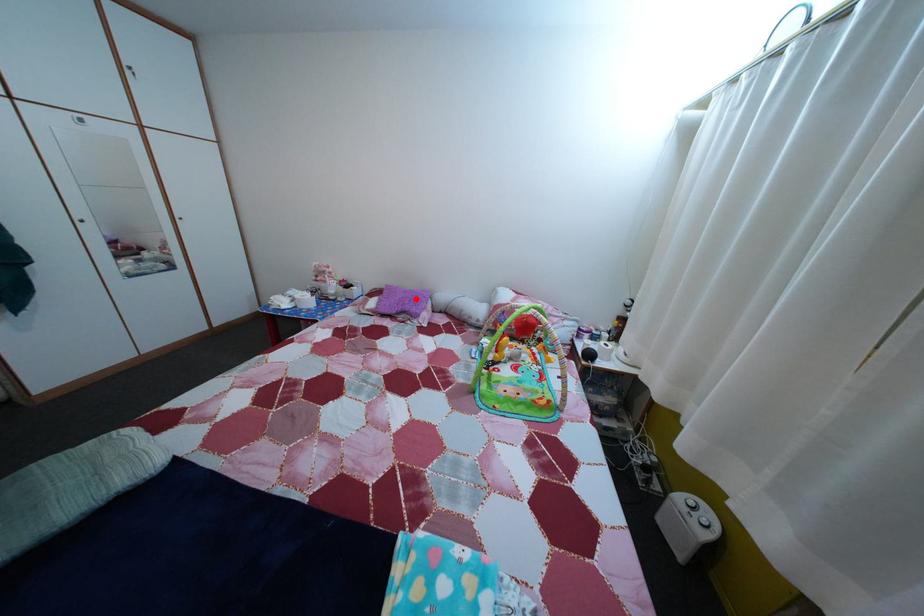
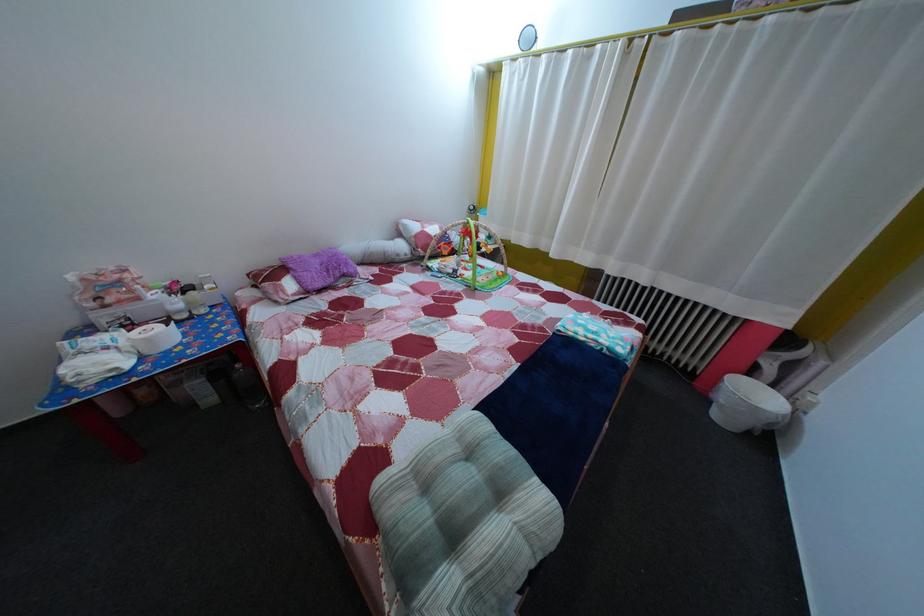
Where in the second image is the point corresponding to the highlighted location from the first image?

(325, 262)